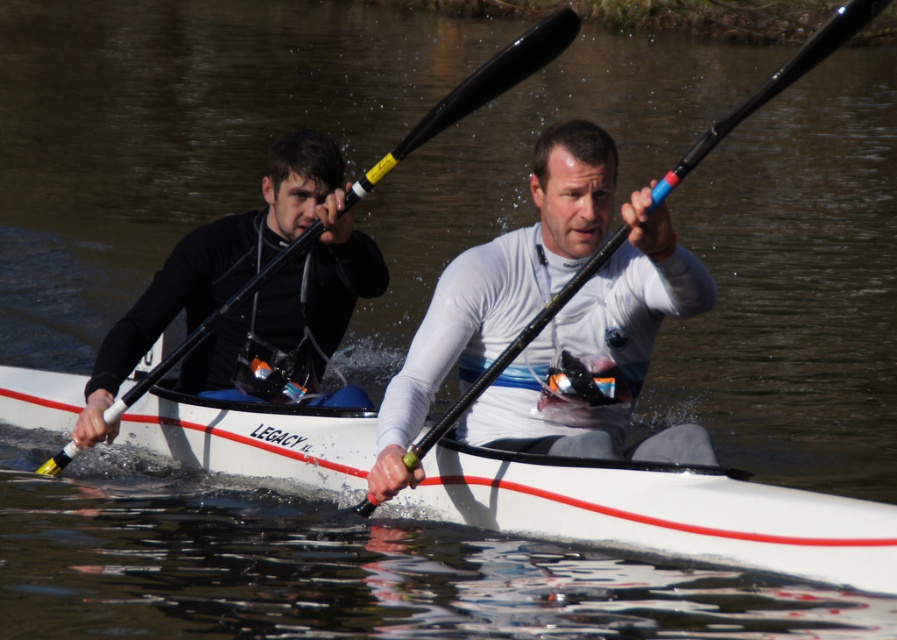
Question: Is white matte kayak at center above black plastic paddle at center?

Choices:
 (A) no
 (B) yes

Answer: (A)

Question: Which is farther from the white matte kayak at center?

Choices:
 (A) matte black wetsuit at left
 (B) white plastic boat at center

Answer: (A)

Question: Which of these objects is positioned farthest from the black plastic paddle at center?

Choices:
 (A) white matte kayak at center
 (B) matte black wetsuit at left
 (C) white plastic boat at center

Answer: (C)

Question: Where is matte black wetsuit at left located in relation to black plastic paddle at center in the image?

Choices:
 (A) right
 (B) left

Answer: (B)

Question: Considering the real-world distances, which object is farthest from the white plastic boat at center?

Choices:
 (A) black rubber paddle at center
 (B) white matte kayak at center

Answer: (A)

Question: Is white plastic boat at center bigger than black rubber paddle at center?

Choices:
 (A) no
 (B) yes

Answer: (A)